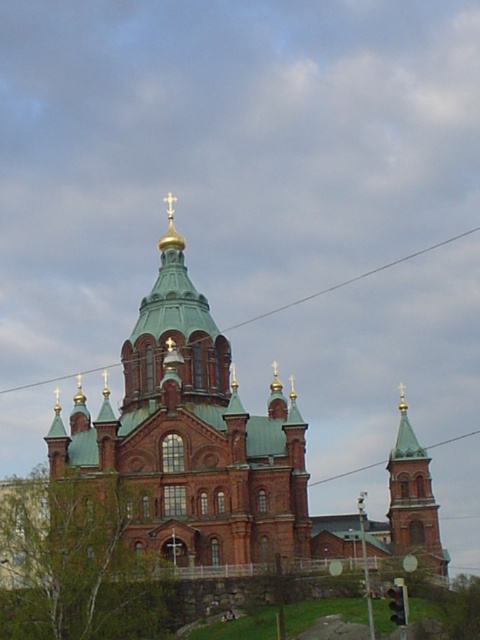
You are a photographer planning to capture the church from the front. You notice the green copper dome at center and the green glass tower at upper center in your viewfinder. Which of these two objects should appear bigger in your final photo?

The green copper dome at center should appear bigger in the photo because it is larger in size than the green glass tower at upper center.